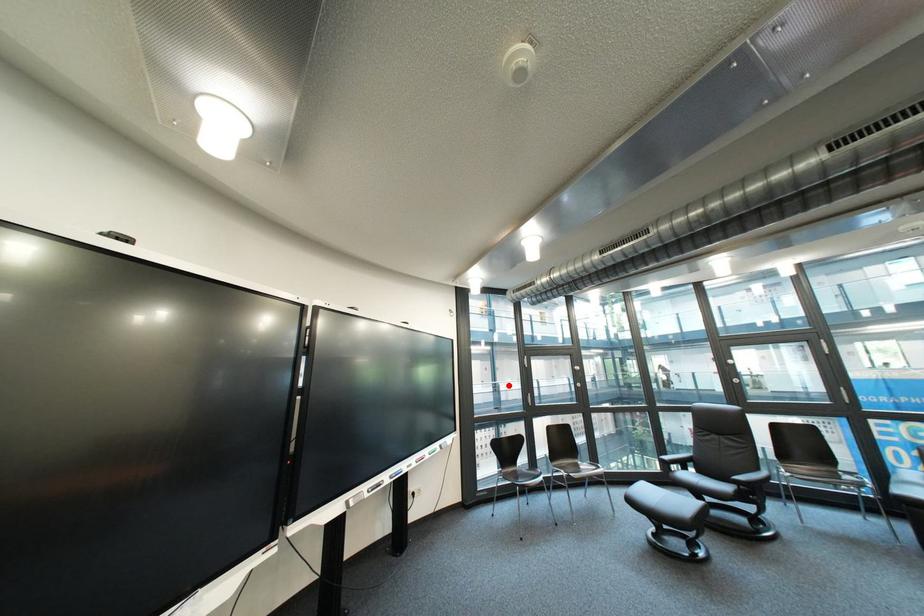
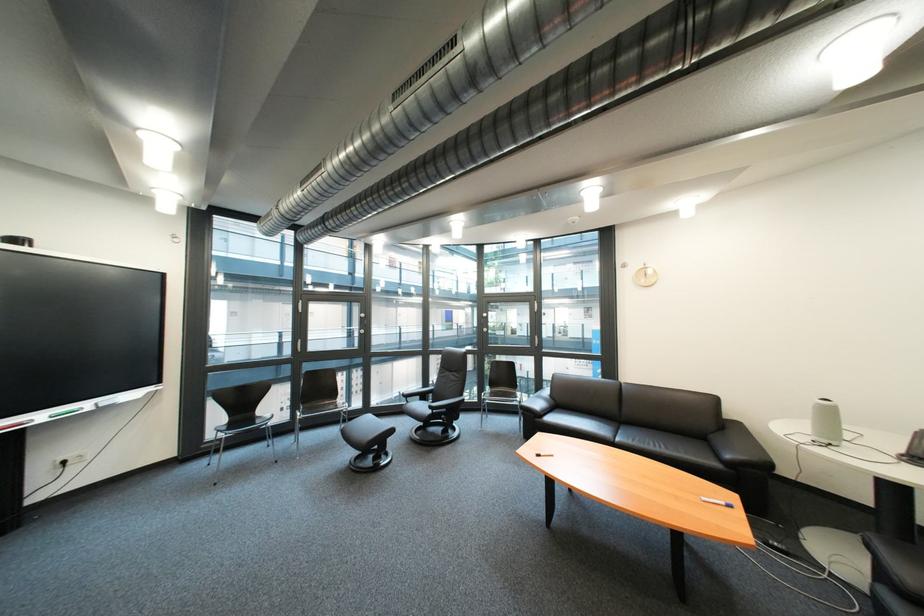
Locate, in the second image, the point that corresponds to the highlighted location in the first image.

(363, 331)